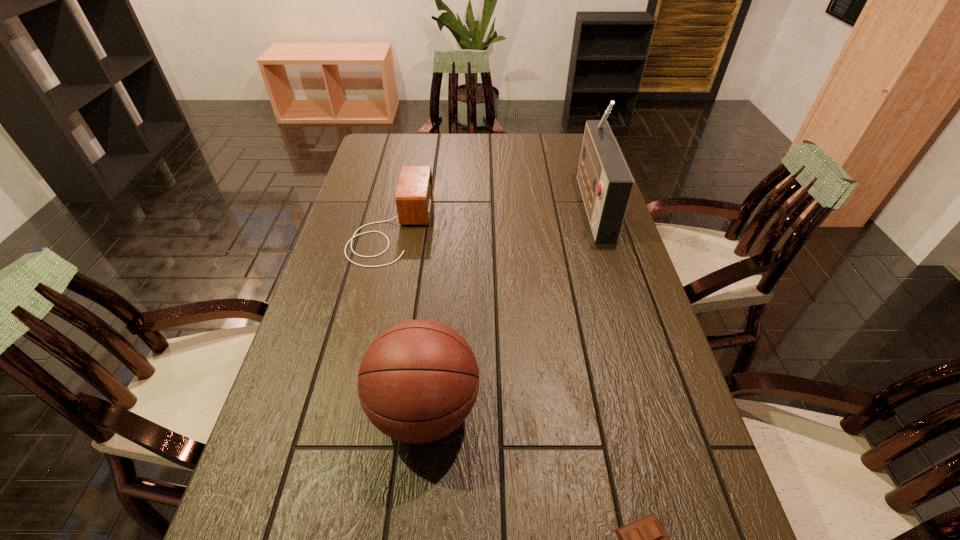
Where is `empty space between the second tallest object and the shorter radio receiver`? This screenshot has height=540, width=960. empty space between the second tallest object and the shorter radio receiver is located at coordinates (408, 319).

Find the location of a particular element. The image size is (960, 540). object that ranks as the closest to the taller radio receiver is located at coordinates (414, 194).

Locate which object ranks second in proximity to the taller radio receiver. Please provide its 2D coordinates. Your answer should be formatted as a tuple, i.e. [(x, y)], where the tuple contains the x and y coordinates of a point satisfying the conditions above.

[(418, 381)]

Find the location of a particular element. vacant area that satisfies the following two spatial constraints: 1. on the front panel of the right radio receiver; 2. on the front side of the third shortest object is located at coordinates (655, 410).

At what (x,y) coordinates should I click in order to perform the action: click on free location that satisfies the following two spatial constraints: 1. on the front panel of the taller radio receiver; 2. on the front side of the third shortest object. Please return your answer as a coordinate pair (x, y). The width and height of the screenshot is (960, 540). Looking at the image, I should click on (655, 410).

Locate an element on the screen. free space that satisfies the following two spatial constraints: 1. on the back side of the third shortest object; 2. on the front-facing side of the shorter radio receiver is located at coordinates (443, 227).